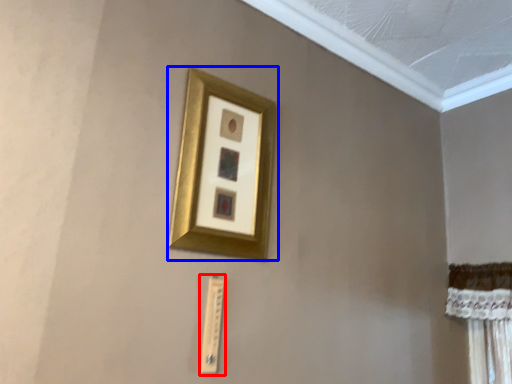
Question: Which object appears closest to the camera in this image, light switch (highlighted by a red box) or picture frame (highlighted by a blue box)?

Choices:
 (A) light switch
 (B) picture frame

Answer: (B)